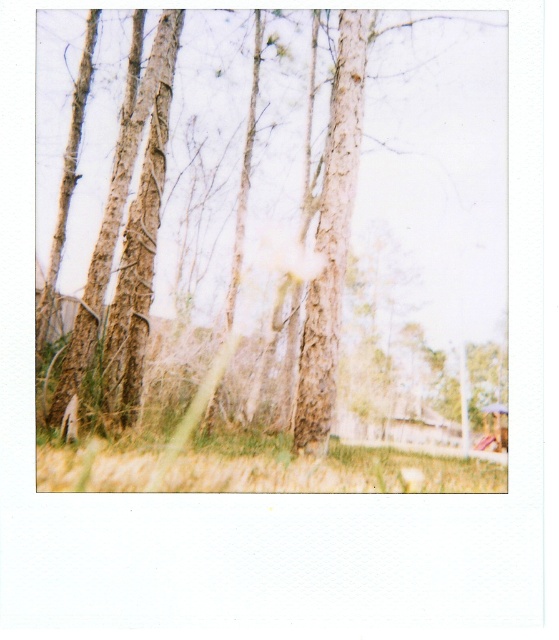
You are a photographer trying to capture a closeup of the rough bark tree at center and the green grass at lower center. Which object will appear wider in your photo?

The rough bark tree at center will appear wider in the photo because its width surpasses that of the green grass at lower center.

You are standing in the scene depicted in the Polaroid photograph. You notice two points marked in the image. Which point is closer to you, point (421, 168) or point (240, 436)?

Point (421, 168) is further to the viewer than point (240, 436), so point (240, 436) is closer to you.